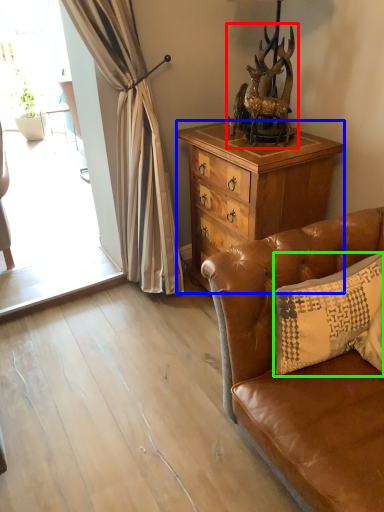
Question: Estimate the real-world distances between objects in this image. Which object is farther from animal (highlighted by a red box), cabinetry (highlighted by a blue box) or pillow (highlighted by a green box)?

Choices:
 (A) cabinetry
 (B) pillow

Answer: (B)